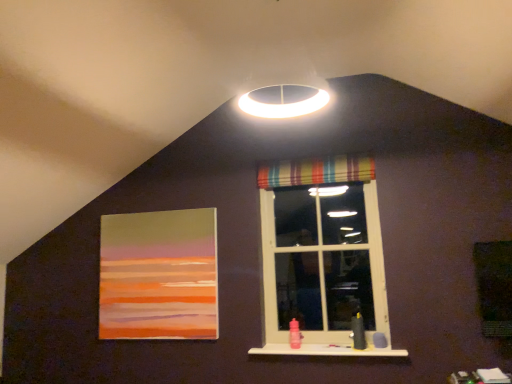
Question: From a real-world perspective, relative to striped fabric curtain at upper center, is striped fabric window at center vertically above or below?

Choices:
 (A) below
 (B) above

Answer: (A)

Question: Is striped fabric window at center inside or outside of striped fabric curtain at upper center?

Choices:
 (A) outside
 (B) inside

Answer: (A)

Question: Estimate the real-world distances between objects in this image. Which object is farther from the striped fabric window at center?

Choices:
 (A) white matte window sill at lower center
 (B) striped fabric curtain at upper center
 (C) matte acrylic painting at left

Answer: (C)

Question: Based on their relative distances, which object is farther from the striped fabric curtain at upper center?

Choices:
 (A) matte acrylic painting at left
 (B) white matte window sill at lower center
 (C) striped fabric window at center

Answer: (B)